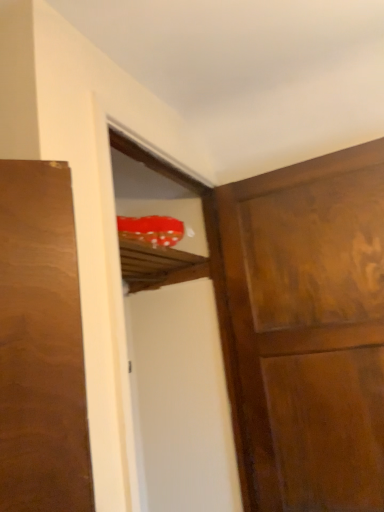
I want to click on free spot above wooden door at upper right (from a real-world perspective), so click(x=293, y=164).